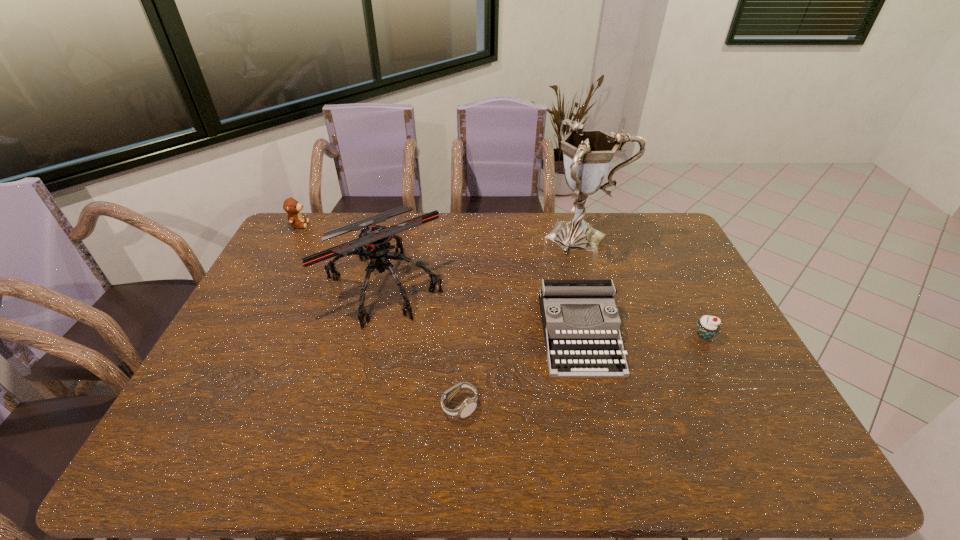
This screenshot has height=540, width=960. I want to click on trophy cup, so click(x=588, y=154).

In order to click on the second object from left to right in this screenshot , I will do `click(376, 239)`.

You are a GUI agent. You are given a task and a screenshot of the screen. Output one action in this format:
    pyautogui.click(x=<x>, y=<y>)
    Task: Click on the drone
    
    Given the screenshot: What is the action you would take?
    pyautogui.click(x=376, y=239)

You are a GUI agent. You are given a task and a screenshot of the screen. Output one action in this format:
    pyautogui.click(x=<x>, y=<y>)
    Task: Click on the leftmost object
    
    Given the screenshot: What is the action you would take?
    pyautogui.click(x=291, y=206)

This screenshot has width=960, height=540. I want to click on typewriter, so click(580, 343).

I want to click on the rightmost object, so click(x=707, y=326).

The height and width of the screenshot is (540, 960). In order to click on the nearest object in this screenshot , I will do `click(468, 406)`.

The height and width of the screenshot is (540, 960). What are the coordinates of `the third object from left to right` in the screenshot? It's located at (468, 406).

The image size is (960, 540). I want to click on vacant area located 0.240m on the front of the trophy cup, so click(607, 313).

Locate an element on the screen. This screenshot has width=960, height=540. vacant space situated on the front of the second object from left to right is located at coordinates (361, 380).